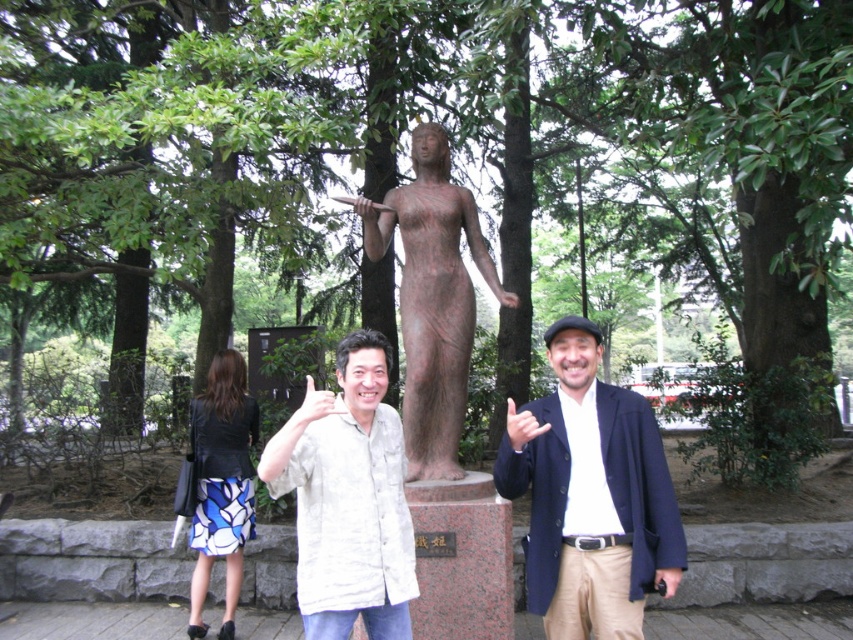
Is point (401, 573) positioned behind point (364, 196)?

No, (401, 573) is in front of (364, 196).

Does white textured shirt at center have a larger size compared to bronze statue at center?

No, white textured shirt at center is not bigger than bronze statue at center.

Locate an element on the screen. This screenshot has width=853, height=640. white textured shirt at center is located at coordinates (347, 499).

Is bronze statue at center to the left of black leather jacket at lower left from the viewer's perspective?

In fact, bronze statue at center is to the right of black leather jacket at lower left.

Is point (413, 456) in front of point (212, 508)?

Yes, it is.

This screenshot has height=640, width=853. Identify the location of bronze statue at center. (432, 298).

Can you confirm if white textured shirt at center is wider than black leather jacket at lower left?

Yes.

The height and width of the screenshot is (640, 853). What are the coordinates of `white textured shirt at center` in the screenshot? It's located at (347, 499).

Locate an element on the screen. This screenshot has height=640, width=853. white textured shirt at center is located at coordinates (347, 499).